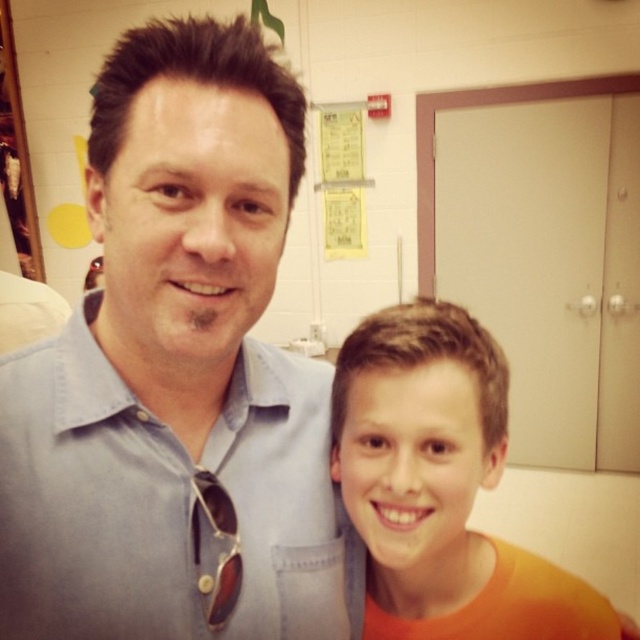
Question: Among these objects, which one is nearest to the camera?

Choices:
 (A) light blue cotton shirt at upper left
 (B) orange matte shirt at right

Answer: (A)

Question: Which object appears farthest from the camera in this image?

Choices:
 (A) light blue cotton shirt at upper left
 (B) orange matte shirt at right

Answer: (B)

Question: Can you confirm if light blue cotton shirt at upper left is bigger than orange matte shirt at right?

Choices:
 (A) no
 (B) yes

Answer: (A)

Question: Considering the relative positions of light blue cotton shirt at upper left and orange matte shirt at right in the image provided, where is light blue cotton shirt at upper left located with respect to orange matte shirt at right?

Choices:
 (A) above
 (B) below

Answer: (A)

Question: Does light blue cotton shirt at upper left have a smaller size compared to orange matte shirt at right?

Choices:
 (A) yes
 (B) no

Answer: (A)